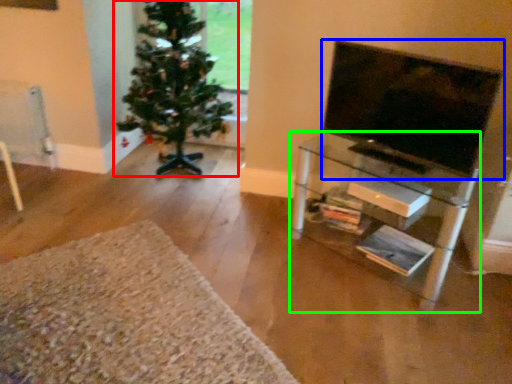
Question: Estimate the real-world distances between objects in this image. Which object is closer to christmas tree (highlighted by a red box), television (highlighted by a blue box) or shelf (highlighted by a green box)?

Choices:
 (A) television
 (B) shelf

Answer: (B)